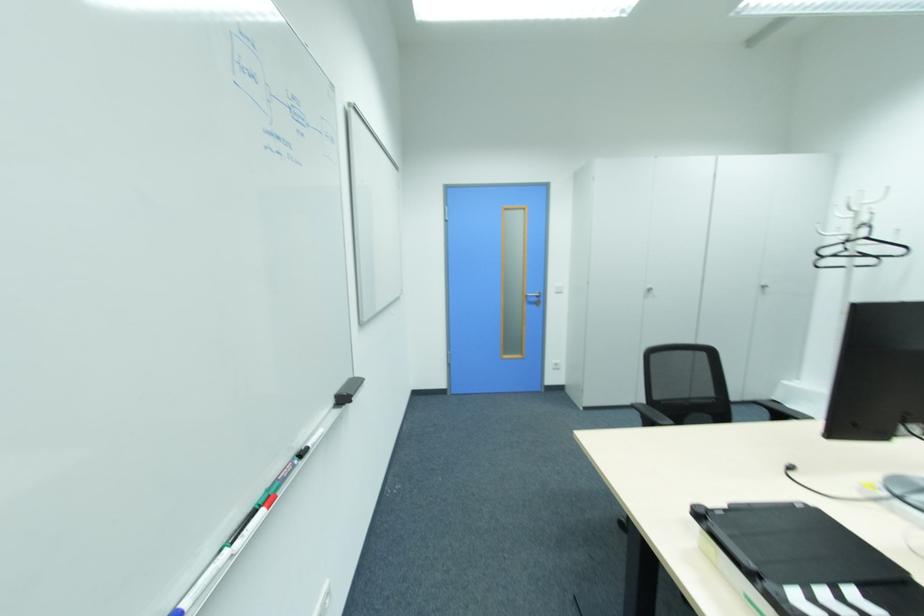
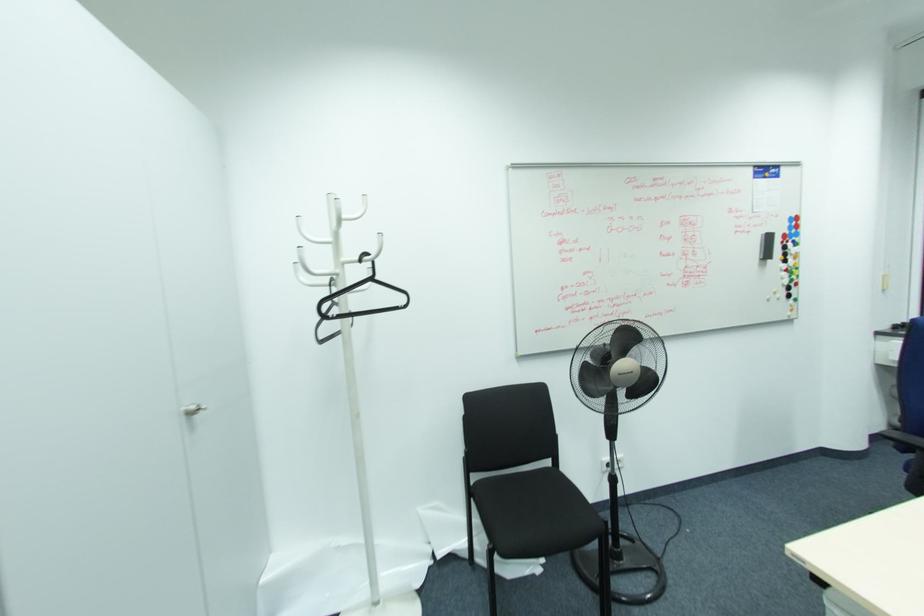
Locate, in the second image, the point that corresponds to [865,238] in the first image.

(371, 280)